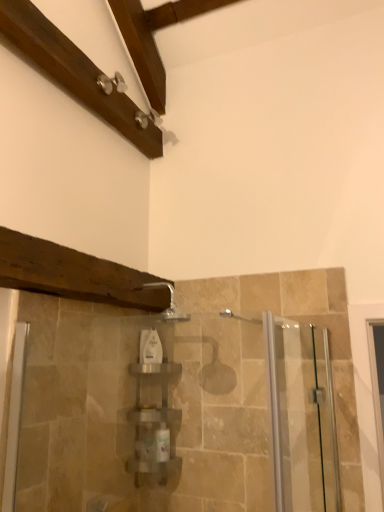
Question: Looking at their shapes, would you say silver metallic faucet at upper center is wider or thinner than clear plastic shelf at center?

Choices:
 (A) wide
 (B) thin

Answer: (A)

Question: In terms of size, does silver metallic faucet at upper center appear bigger or smaller than clear plastic shelf at center?

Choices:
 (A) big
 (B) small

Answer: (B)

Question: Estimate the real-world distances between objects in this image. Which object is farther from the clear glass screen door at right?

Choices:
 (A) white glossy bottle at center
 (B) clear plastic shelf at center
 (C) silver metallic faucet at upper center

Answer: (A)

Question: Estimate the real-world distances between objects in this image. Which object is closer to the clear plastic shelf at center?

Choices:
 (A) clear glass screen door at right
 (B) white glossy bottle at center
 (C) silver metallic faucet at upper center

Answer: (B)